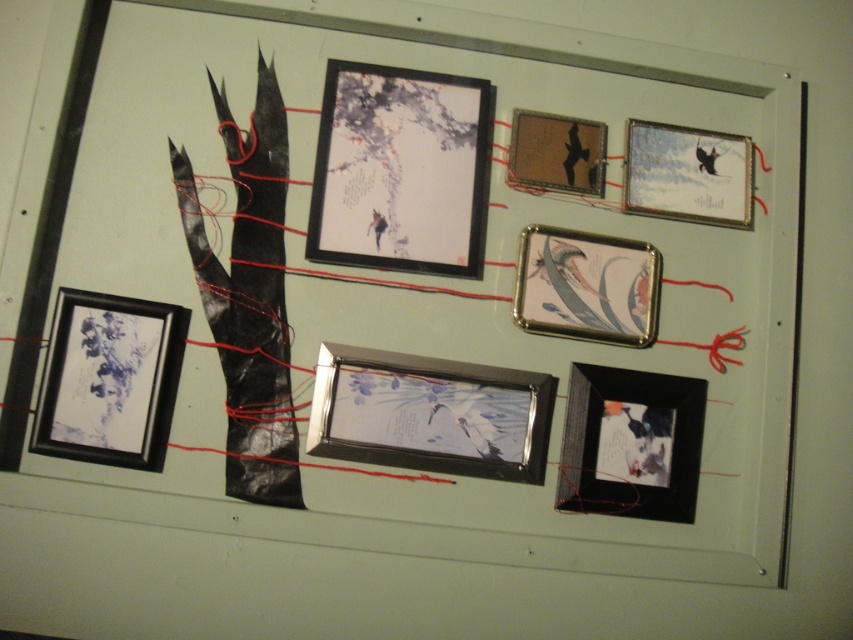
You are an art curator planning to install a new sculpture in the display area. The new sculpture will be placed at point [399,170]. Which existing object at this coordinate is it overlapping with?

The point [399,170] corresponds to the location of the matte black frame at upper center, so the new sculpture will overlap with the matte black frame at upper center.

You are an art curator planning to install a new sculpture in the display area. The new sculpture will be placed at the point with coordinates point (585, 285). Based on the existing layout, which object is located at this coordinate?

The point (585, 285) is on metallic silver picture frame at center right.